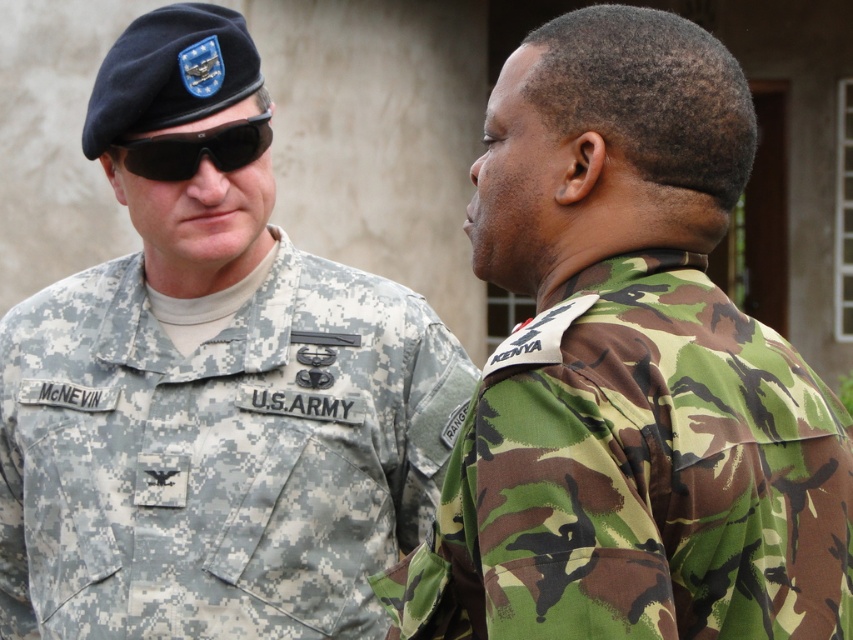
Which object is wider, the camouflage fabric uniform at right or the black matte goggles at upper left?

The camouflage fabric uniform at right is wider than the black matte goggles at upper left according to the description.

You are a photographer trying to capture a clear photo of both the digital camouflage uniform at left and the black matte goggles at upper left. Since the camera can only focus on one object at a time, which object should you focus on to ensure the other is still in the frame?

The digital camouflage uniform at left might be wider than black matte goggles at upper left, so focusing on the digital camouflage uniform at left would ensure the black matte goggles at upper left remains in the frame.

You are a drone operator observing the scene. You need to identify the location of the point with coordinates (630, 371). Which object in the scene does this point correspond to?

The point at coordinates (630, 371) corresponds to the camouflage fabric uniform at right.